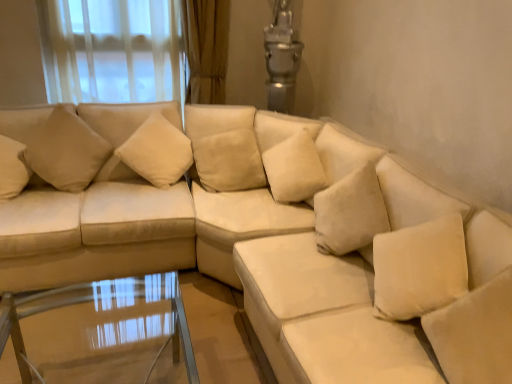
Question: Is transparent glass table at lower center at the back of beige fabric pillow at upper left, positioned as the second pillow in left-to-right order?

Choices:
 (A) no
 (B) yes

Answer: (A)

Question: Would you say transparent glass table at lower center is part of beige fabric pillow at upper left, positioned as the second pillow in left-to-right order,'s contents?

Choices:
 (A) no
 (B) yes

Answer: (A)

Question: Can you confirm if beige fabric pillow at upper left, arranged as the 3th pillow when viewed from the right, is thinner than transparent glass table at lower center?

Choices:
 (A) yes
 (B) no

Answer: (A)

Question: Considering the relative sizes of beige fabric pillow at upper left, positioned as the second pillow in left-to-right order, and transparent glass table at lower center in the image provided, is beige fabric pillow at upper left, positioned as the second pillow in left-to-right order, smaller than transparent glass table at lower center?

Choices:
 (A) yes
 (B) no

Answer: (A)

Question: Is the position of beige fabric pillow at upper left, positioned as the second pillow in left-to-right order, more distant than that of transparent glass table at lower center?

Choices:
 (A) yes
 (B) no

Answer: (A)

Question: Based on their positions, is transparent glass table at lower center located to the left or right of beige fabric pillow at upper left, the 4th pillow when ordered from right to left?

Choices:
 (A) right
 (B) left

Answer: (A)

Question: Do you think transparent glass table at lower center is within beige fabric pillow at upper left, the 4th pillow when ordered from right to left, or outside of it?

Choices:
 (A) outside
 (B) inside

Answer: (A)

Question: Considering the positions of transparent glass table at lower center and beige fabric pillow at upper left, which is the first pillow in left-to-right order, in the image, is transparent glass table at lower center taller or shorter than beige fabric pillow at upper left, which is the first pillow in left-to-right order,?

Choices:
 (A) short
 (B) tall

Answer: (A)

Question: In terms of width, does transparent glass table at lower center look wider or thinner when compared to beige fabric pillow at upper left, the 4th pillow when ordered from right to left?

Choices:
 (A) wide
 (B) thin

Answer: (A)

Question: Is point (98, 150) positioned closer to the camera than point (203, 107)?

Choices:
 (A) closer
 (B) farther

Answer: (A)

Question: From the image's perspective, is beige fabric pillow at upper left, the 4th pillow when ordered from right to left, located above or below beige fabric pillow at center, which is the second pillow in right-to-left order?

Choices:
 (A) below
 (B) above

Answer: (B)

Question: Considering the positions of beige fabric pillow at upper left, the 4th pillow when ordered from right to left, and beige fabric pillow at center, which is the second pillow in right-to-left order, in the image, is beige fabric pillow at upper left, the 4th pillow when ordered from right to left, wider or thinner than beige fabric pillow at center, which is the second pillow in right-to-left order,?

Choices:
 (A) thin
 (B) wide

Answer: (A)

Question: From a real-world perspective, is beige fabric pillow at upper left, which is the first pillow in left-to-right order, physically located above or below beige fabric pillow at center, placed as the 3th pillow when sorted from left to right?

Choices:
 (A) below
 (B) above

Answer: (B)

Question: From their relative heights in the image, would you say beige fabric pillow at upper left, the 4th pillow when ordered from right to left, is taller or shorter than transparent glass table at lower center?

Choices:
 (A) short
 (B) tall

Answer: (B)

Question: In terms of width, does beige fabric pillow at upper left, which is the first pillow in left-to-right order, look wider or thinner when compared to transparent glass table at lower center?

Choices:
 (A) thin
 (B) wide

Answer: (A)